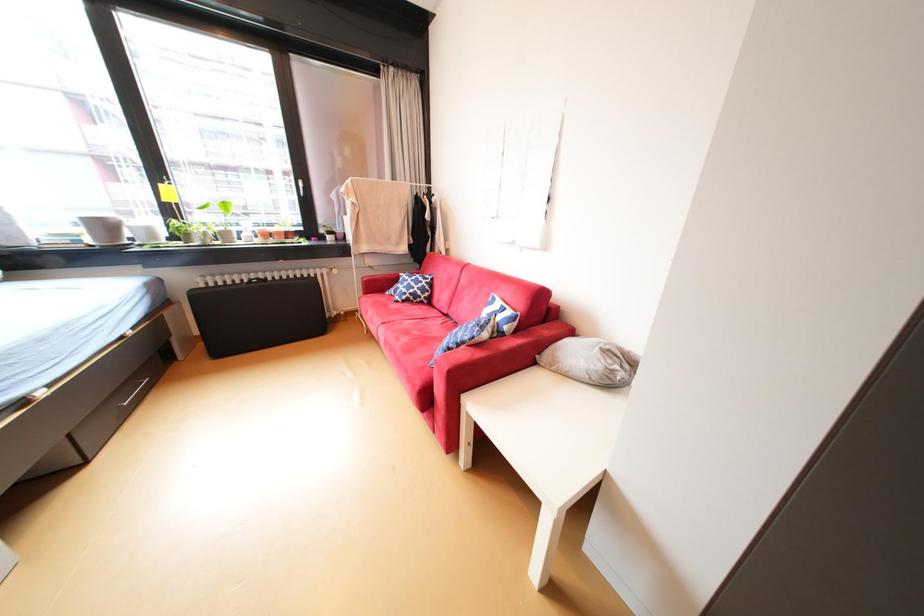
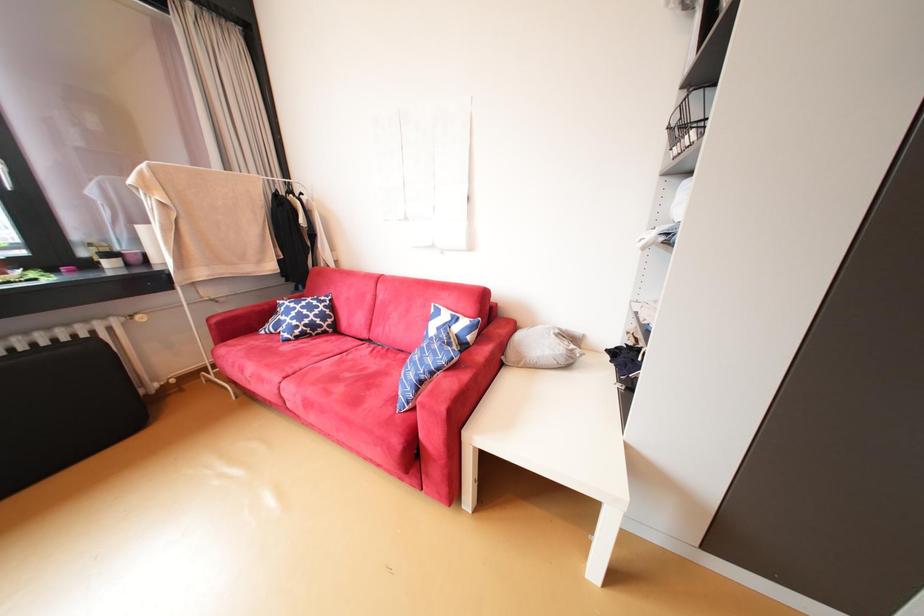
Question: Based on the continuous images, in which direction is the camera rotating? Reply with the corresponding letter.

Choices:
 (A) Left
 (B) Right
 (C) Up
 (D) Down

Answer: (B)